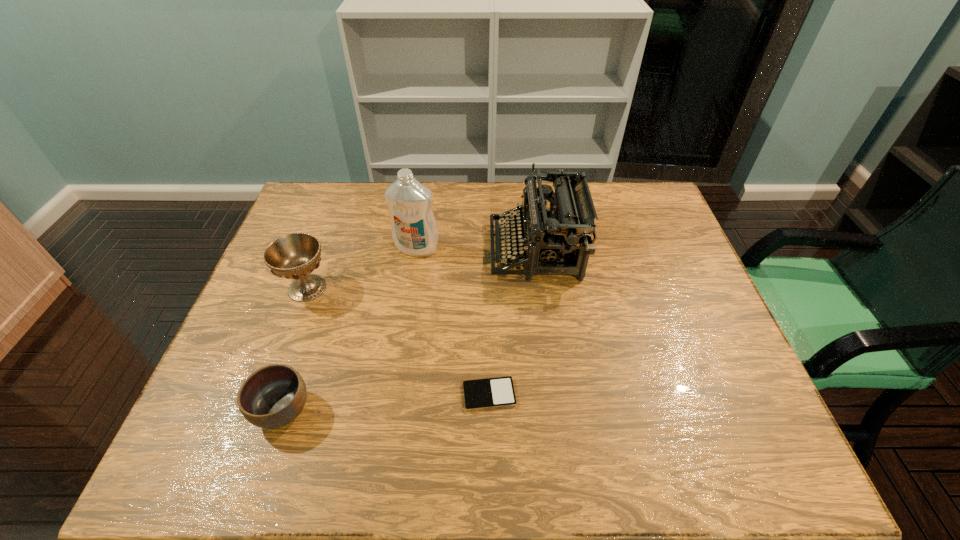
You are a GUI agent. You are given a task and a screenshot of the screen. Output one action in this format:
    pyautogui.click(x=<x>, y=<y>)
    Task: Click on the detergent
    This screenshot has height=540, width=960.
    Given the screenshot: What is the action you would take?
    (414, 230)

Where is `the tallest object`? The width and height of the screenshot is (960, 540). the tallest object is located at coordinates (414, 230).

Find the location of a particular element. This screenshot has width=960, height=540. typewriter is located at coordinates (561, 235).

This screenshot has height=540, width=960. I want to click on the third shortest object, so click(x=295, y=256).

Where is `the second shortest object`? The height and width of the screenshot is (540, 960). the second shortest object is located at coordinates (273, 396).

You are a GUI agent. You are given a task and a screenshot of the screen. Output one action in this format:
    pyautogui.click(x=<x>, y=<y>)
    Task: Click on the shortest object
    
    Given the screenshot: What is the action you would take?
    497,392

You are a GUI agent. You are given a task and a screenshot of the screen. Output one action in this format:
    pyautogui.click(x=<x>, y=<y>)
    Task: Click on the vacant space located 0.230m on the back of the detergent
    The height and width of the screenshot is (540, 960).
    Given the screenshot: What is the action you would take?
    pyautogui.click(x=425, y=194)

The image size is (960, 540). Find the location of `vacant space located 0.090m on the typing side of the fourth shortest object`. vacant space located 0.090m on the typing side of the fourth shortest object is located at coordinates (460, 250).

This screenshot has width=960, height=540. Find the location of `vacant space located on the typing side of the fourth shortest object`. vacant space located on the typing side of the fourth shortest object is located at coordinates (457, 250).

Where is `vacant space located on the typing side of the fourth shortest object`? vacant space located on the typing side of the fourth shortest object is located at coordinates (408, 250).